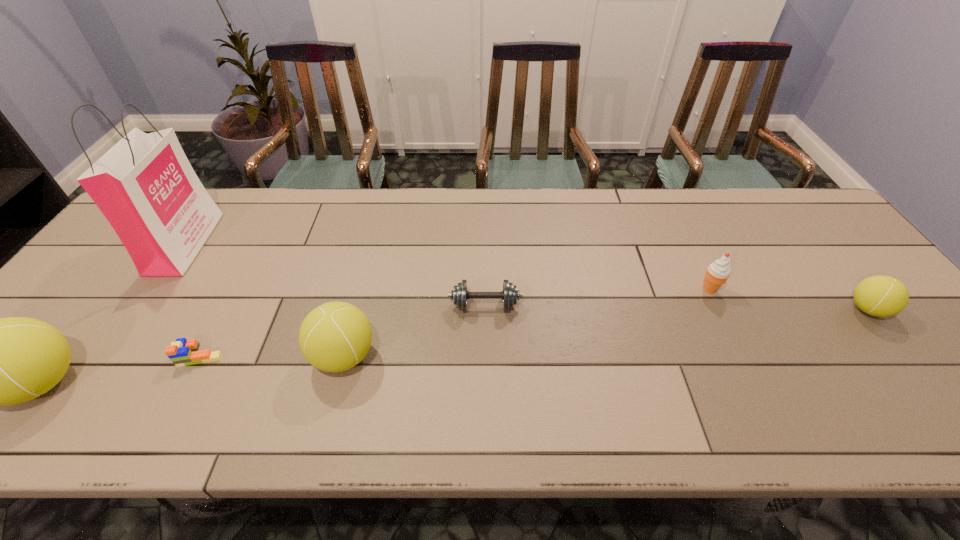
Locate an element on the screen. Lego present at the near edge is located at coordinates (182, 352).

Where is `object positioned at the left edge`? The height and width of the screenshot is (540, 960). object positioned at the left edge is located at coordinates (145, 186).

Identify the location of object that is at the right edge. This screenshot has height=540, width=960. 881,296.

Identify the location of object that is at the far left corner. (145, 186).

Where is `free space at the far edge of the desktop`? free space at the far edge of the desktop is located at coordinates (348, 212).

I want to click on vacant space at the near edge of the desktop, so click(448, 375).

The image size is (960, 540). I want to click on vacant region between the fifth object from right to left and the icecream, so click(455, 322).

The height and width of the screenshot is (540, 960). I want to click on vacant area that lies between the farthest object and the third object from left to right, so click(x=193, y=300).

The height and width of the screenshot is (540, 960). I want to click on empty space between the sixth object from left to right and the Lego, so click(x=455, y=322).

Locate an element on the screen. free point between the fifth object from right to left and the rightmost object is located at coordinates (534, 333).